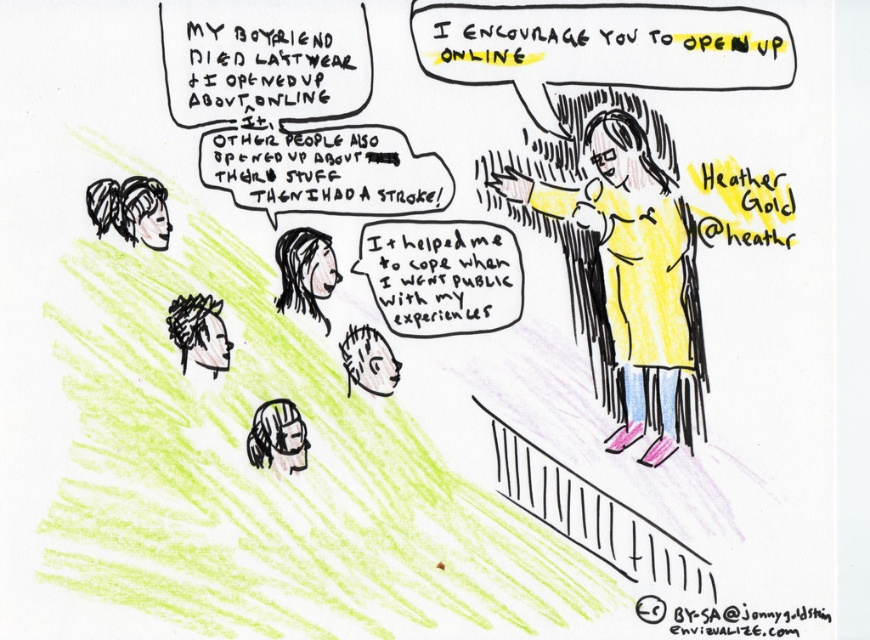
Between yellow matte shirt at upper right and black hair at lower left, which one appears on the left side from the viewer's perspective?

Positioned to the left is black hair at lower left.

Find the location of `yellow matte shirt at upper right`. yellow matte shirt at upper right is located at coordinates (633, 280).

Does yellow matte shirt at upper right have a larger size compared to smooth white face at center?

Indeed, yellow matte shirt at upper right has a larger size compared to smooth white face at center.

Does yellow matte shirt at upper right have a smaller size compared to smooth white face at center?

Actually, yellow matte shirt at upper right might be larger than smooth white face at center.

Image resolution: width=870 pixels, height=640 pixels. Describe the element at coordinates (633, 280) in the screenshot. I see `yellow matte shirt at upper right` at that location.

Where is `yellow matte shirt at upper right`? The height and width of the screenshot is (640, 870). yellow matte shirt at upper right is located at coordinates (633, 280).

Which is in front, point (273, 452) or point (393, 358)?

Positioned in front is point (273, 452).

Is white hair at lower left above white paper at lower center?

Actually, white hair at lower left is below white paper at lower center.

Between point (278, 406) and point (346, 360), which one is positioned in front?

Point (278, 406) is more forward.

What are the coordinates of `white hair at lower left` in the screenshot? It's located at (278, 436).